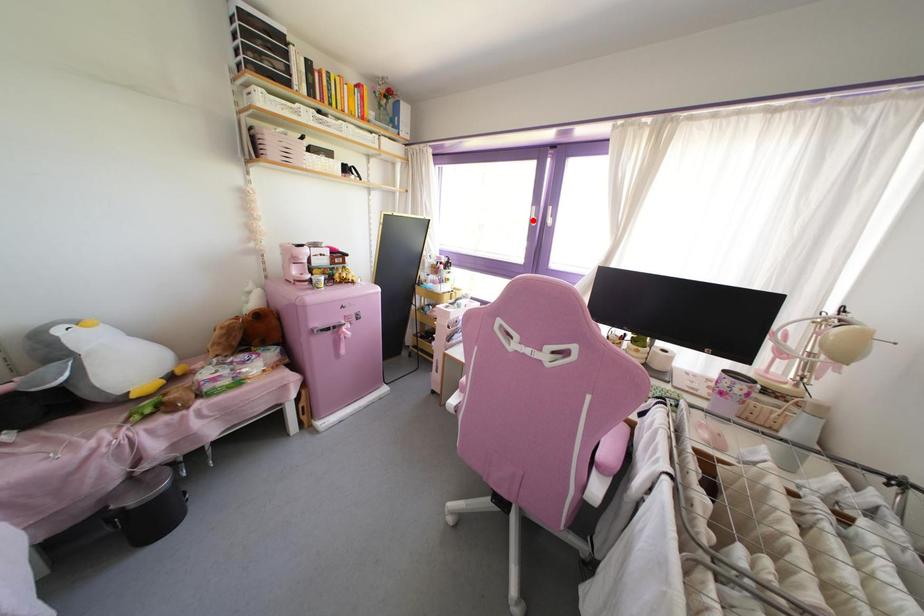
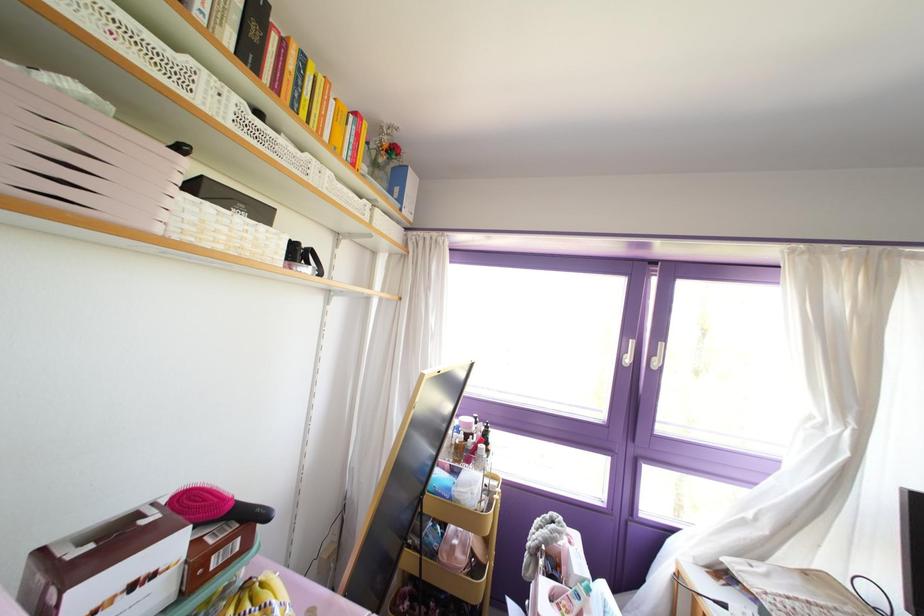
The point at the highlighted location is marked in the first image. Where is the corresponding point in the second image?

(626, 360)